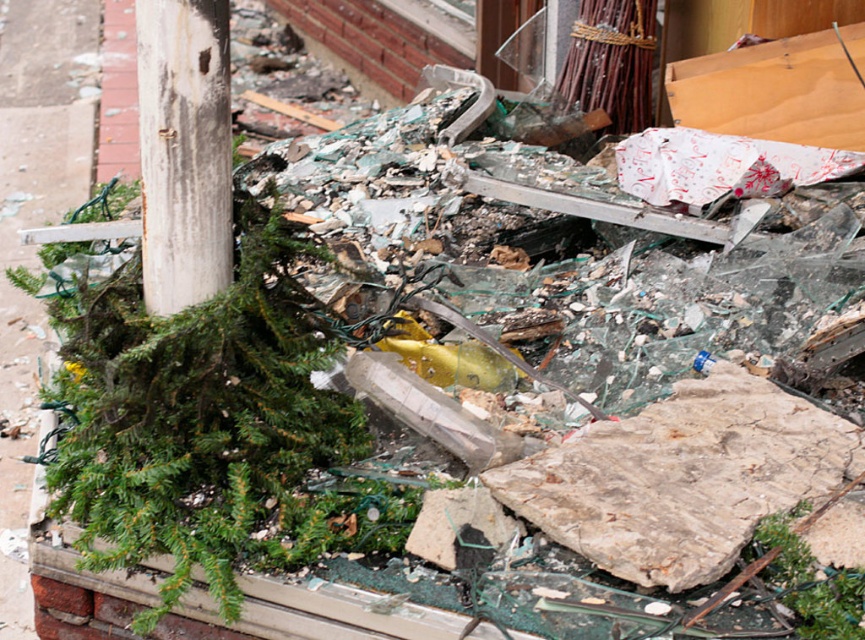
Question: Does brown concrete pavement at left have a larger size compared to white weathered wood post at upper left?

Choices:
 (A) no
 (B) yes

Answer: (B)

Question: Does brown concrete pavement at left come in front of white weathered wood post at upper left?

Choices:
 (A) no
 (B) yes

Answer: (A)

Question: Does brown concrete pavement at left appear on the left side of white weathered wood post at upper left?

Choices:
 (A) no
 (B) yes

Answer: (B)

Question: Which object appears farthest from the camera in this image?

Choices:
 (A) brown concrete pavement at left
 (B) white weathered wood post at upper left

Answer: (A)